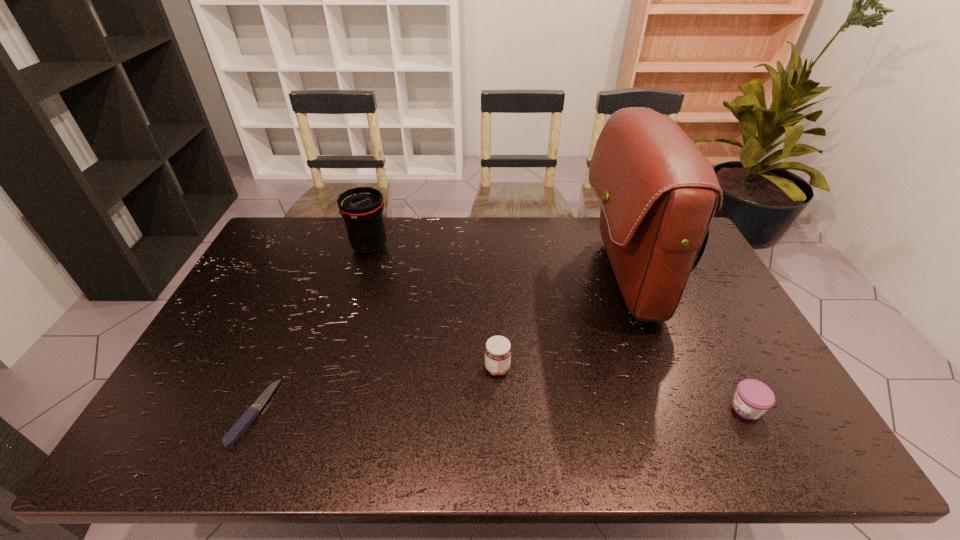
The height and width of the screenshot is (540, 960). I want to click on vacant space that satisfies the following two spatial constraints: 1. on the open flap of the tallest object; 2. on the front side of the third farthest object, so click(x=658, y=368).

At what (x,y) coordinates should I click in order to perform the action: click on free location that satisfies the following two spatial constraints: 1. on the front label of the fourth tallest object; 2. on the front side of the steak knife. Please return your answer as a coordinate pair (x, y). The image size is (960, 540). Looking at the image, I should click on (749, 413).

I want to click on free spot that satisfies the following two spatial constraints: 1. on the front label of the nearer jam; 2. on the front side of the shortest object, so (x=749, y=413).